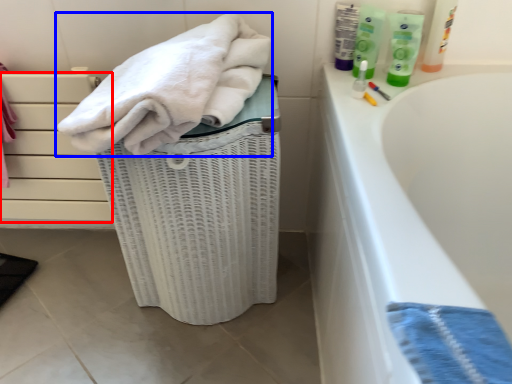
Question: Among these objects, which one is nearest to the camera, drawer (highlighted by a red box) or towel (highlighted by a blue box)?

Choices:
 (A) drawer
 (B) towel

Answer: (B)